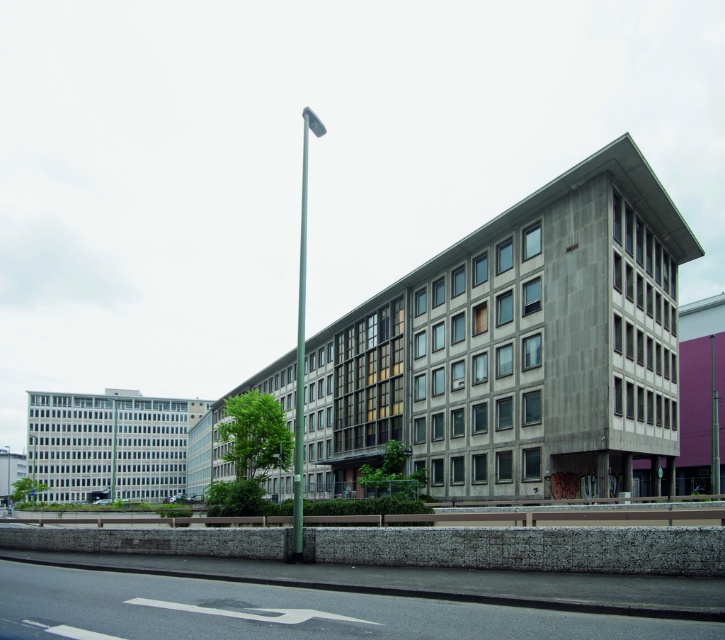
Between green metallic pole at center and silver metallic pole at center, which one appears on the right side from the viewer's perspective?

green metallic pole at center

At what (x,y) coordinates should I click in order to perform the action: click on green metallic pole at center. Please return your answer as a coordinate pair (x, y). The height and width of the screenshot is (640, 725). Looking at the image, I should click on (302, 344).

Find the location of `green metallic pole at center`. green metallic pole at center is located at coordinates (302, 344).

At what (x,y) coordinates should I click in order to perform the action: click on green metallic pole at center. Please return your answer as a coordinate pair (x, y). Looking at the image, I should click on (302, 344).